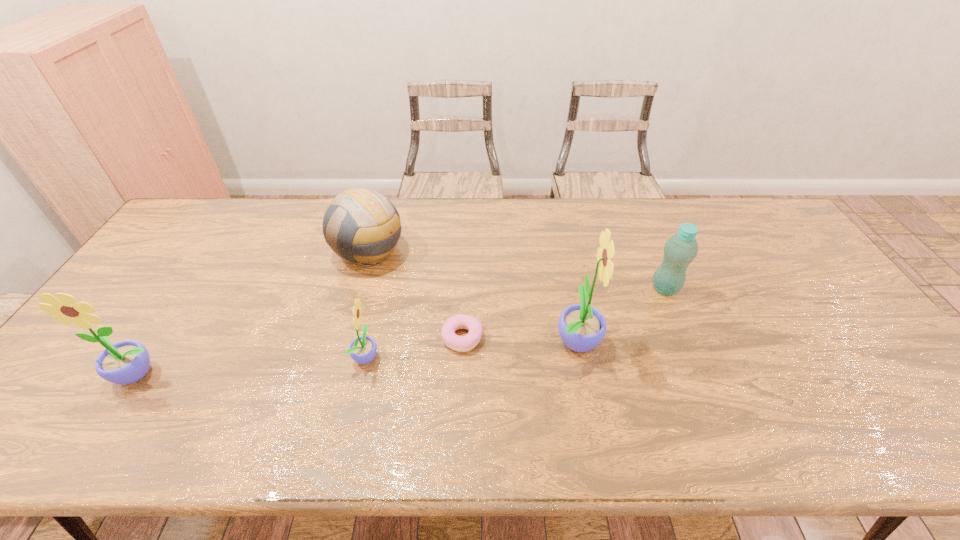
Please point a free position for a sunflower on the right. Please provide its 2D coordinates. Your answer should be formatted as a tuple, i.e. [(x, y)], where the tuple contains the x and y coordinates of a point satisfying the conditions above.

[(775, 322)]